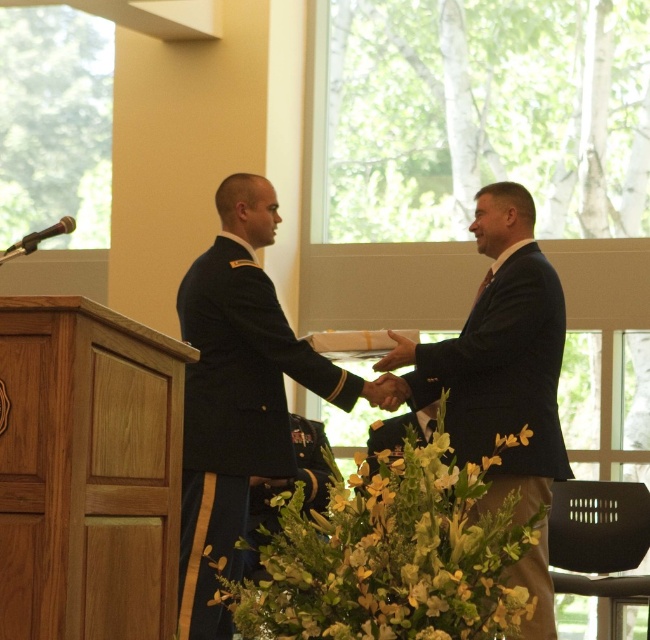
You are organizing a photo shoot and need to ensure that the dark blue suit at center and the green leafy plant at center are both visible in the frame. Based on their widths, which object should be placed closer to the edge of the camera frame to avoid overcrowding?

The dark blue suit at center should be placed closer to the edge of the camera frame because its width is narrower than the green leafy plant at center, allowing more space for the wider plant in the center.